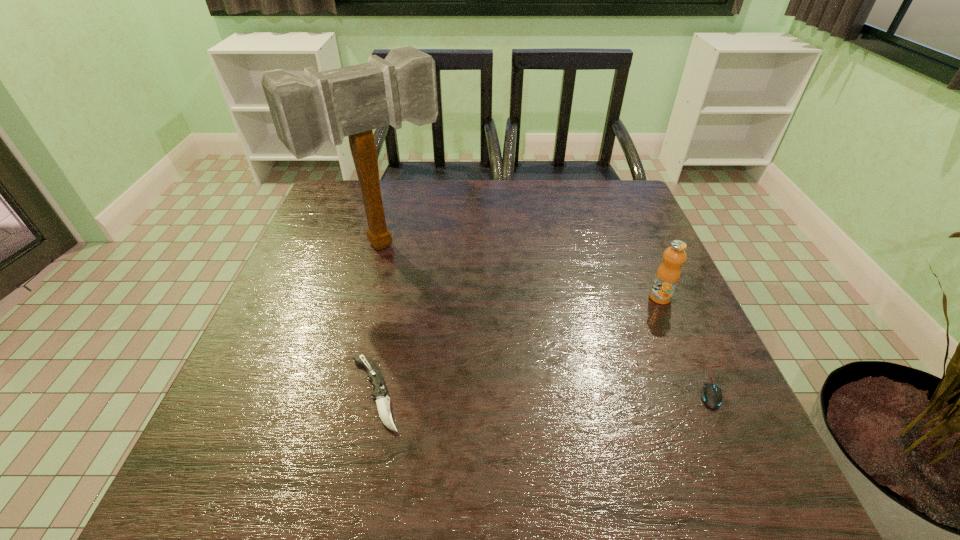
Image resolution: width=960 pixels, height=540 pixels. Identify the location of vacant space located 0.190m on the front label of the second tallest object. (593, 339).

Locate an element on the screen. vacant area located 0.090m at the head of the tallest object is located at coordinates (432, 291).

This screenshot has height=540, width=960. Identify the location of free point located 0.270m at the head of the tallest object. (476, 340).

The height and width of the screenshot is (540, 960). In order to click on vacant space located at the head of the tallest object in this screenshot , I will do `click(491, 355)`.

This screenshot has width=960, height=540. Find the location of `object present at the far edge`. object present at the far edge is located at coordinates (308, 110).

Where is `pocketknife that is at the near edge`? pocketknife that is at the near edge is located at coordinates (380, 393).

Where is `mouse at the near edge`? This screenshot has height=540, width=960. mouse at the near edge is located at coordinates (712, 397).

Where is `object that is at the left edge`? The image size is (960, 540). object that is at the left edge is located at coordinates (308, 110).

You are a GUI agent. You are given a task and a screenshot of the screen. Output one action in this format:
    pyautogui.click(x=<x>, y=<y>)
    Task: Click on the mouse situated at the right edge
    Image resolution: width=960 pixels, height=540 pixels.
    Given the screenshot: What is the action you would take?
    pyautogui.click(x=712, y=397)

I want to click on orange juice that is at the right edge, so 668,274.